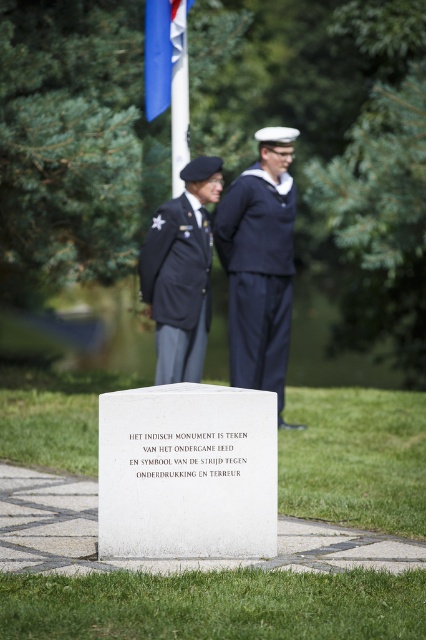
You are a photographer standing at the monument. You want to take a photo that includes both the navy blue fabric sailor suit at center and the blue fabric flag at upper center. What is the minimum distance you need to move backward to ensure both are in frame?

The navy blue fabric sailor suit at center and blue fabric flag at upper center are 5.07 feet apart. To include both in the frame, you need to move back at least 5.07 feet to ensure the camera can capture the entire distance between them.

You are a photographer positioned in the park and want to capture both the dark blue fabric uniform at center and the blue fabric flag at upper center in the same frame. Based on their positions, can you see both objects clearly without any obstruction?

Yes, the dark blue fabric uniform at center is in front of the blue fabric flag at upper center, but since the flag is at upper center, it should be visible above the uniform, allowing both to be seen in the frame.

You are a photographer trying to capture both the dark blue fabric uniform at center and the navy blue fabric sailor suit at center in a single frame. Since you want to ensure both are clearly visible, which one should you focus on first to make sure they are in focus?

The navy blue fabric sailor suit at center should be focused on first because it is in front of the dark blue fabric uniform at center. By focusing on the closer object, the background object may still be in acceptable focus depending on the lens and aperture used, but ensuring the front subject is sharp is crucial.